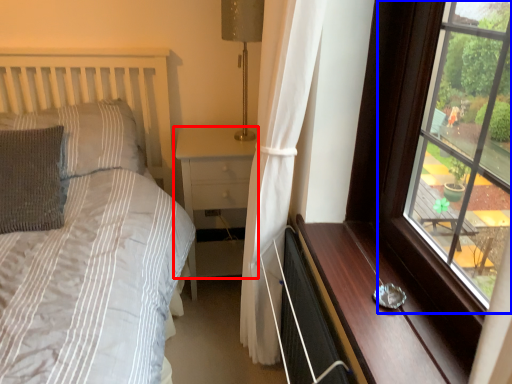
Question: Which of the following is the closest to the observer, nightstand (highlighted by a red box) or window (highlighted by a blue box)?

Choices:
 (A) nightstand
 (B) window

Answer: (B)